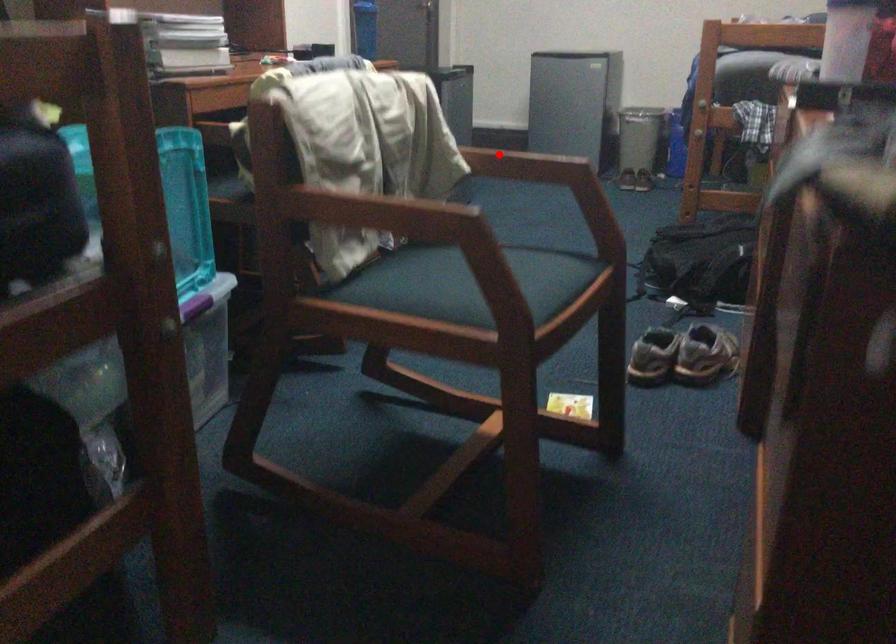
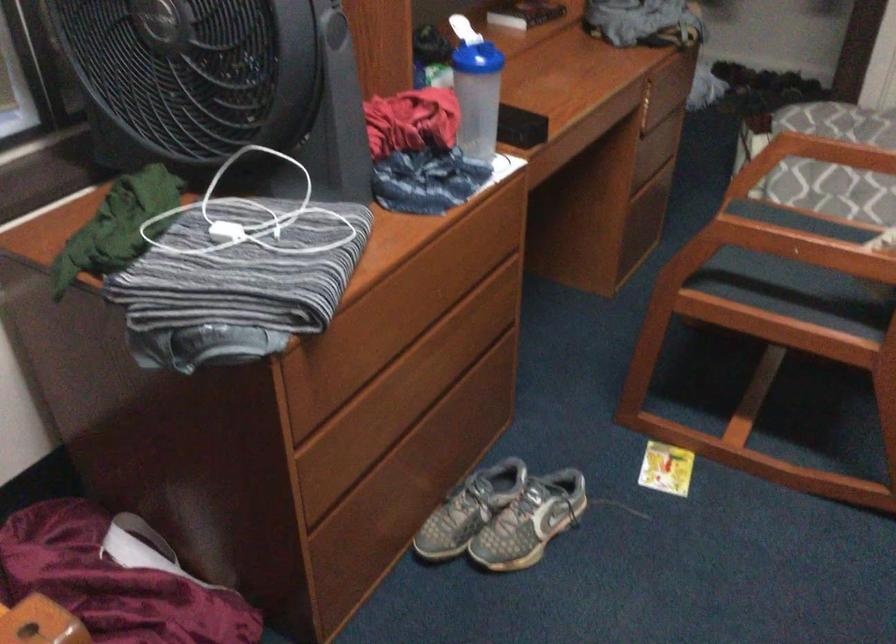
Question: I am providing you with two images of the same scene from different viewpoints. Given a red point in image1, look at the same physical point in image2. Is it:

Choices:
 (A) Closer to the viewpoint
 (B) Farther from the viewpoint

Answer: (A)